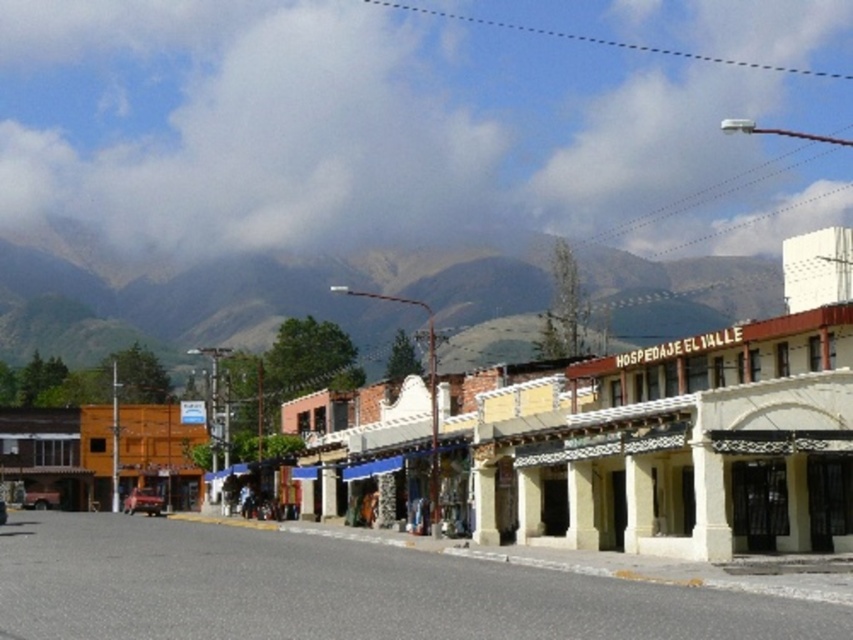
Which of these two, yellow stucco building at center or green textured mountain at upper center, stands taller?

Standing taller between the two is yellow stucco building at center.

Can you confirm if yellow stucco building at center is taller than green textured mountain at upper center?

Yes.

Who is more distant from viewer, [300,419] or [65,237]?

The point [65,237] is behind.

I want to click on yellow stucco building at center, so click(663, 438).